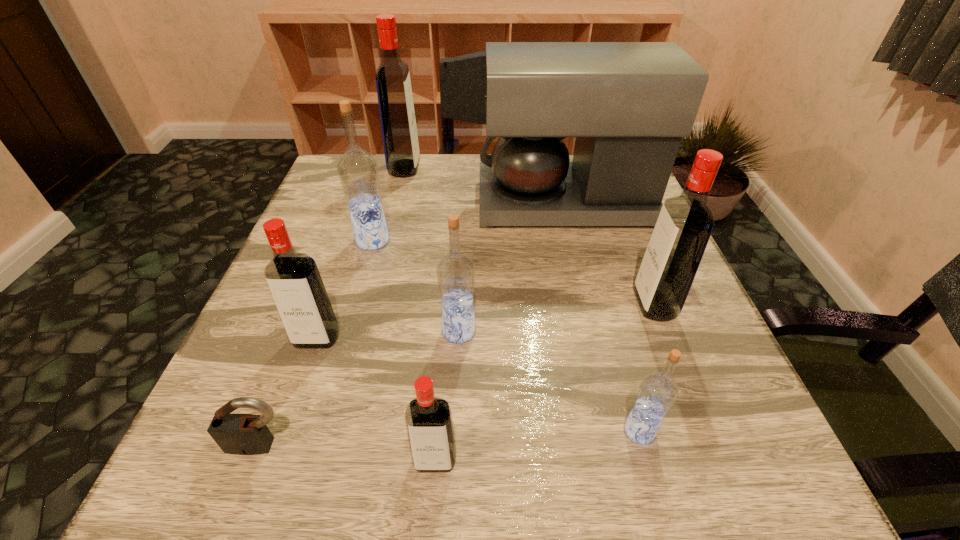
Find the location of a particular element. This screenshot has width=960, height=540. free space between the farthest blue vodka and the smallest red vodka is located at coordinates (404, 350).

Find the location of `free spot between the coffee maker and the nearest red vodka`. free spot between the coffee maker and the nearest red vodka is located at coordinates (499, 332).

What are the coordinates of `empty space that is in between the second farthest vodka and the coffee maker` in the screenshot? It's located at (468, 222).

I want to click on free space between the second biggest red vodka and the shortest object, so click(x=457, y=375).

Find the location of a particular element. The image size is (960, 540). vacant space that is in between the shortest object and the second nearest blue vodka is located at coordinates (359, 388).

At what (x,y) coordinates should I click in order to perform the action: click on free space that is in between the rightmost blue vodka and the second blue vodka from right to left. Please return your answer as a coordinate pair (x, y). The height and width of the screenshot is (540, 960). Looking at the image, I should click on (549, 381).

Locate an element on the screen. free space between the shortest object and the farthest object is located at coordinates (332, 307).

I want to click on vacant space that is in between the smallest blue vodka and the third nearest red vodka, so click(x=647, y=368).

You are a GUI agent. You are given a task and a screenshot of the screen. Output one action in this format:
    pyautogui.click(x=<x>, y=<y>)
    Task: Click on the free space between the leftmost blue vodka and the second biggest red vodka
    
    Given the screenshot: What is the action you would take?
    pyautogui.click(x=514, y=273)

Choose which object is the third nearest neighbor to the padlock. Please provide its 2D coordinates. Your answer should be formatted as a tuple, i.e. [(x, y)], where the tuple contains the x and y coordinates of a point satisfying the conditions above.

[(456, 272)]